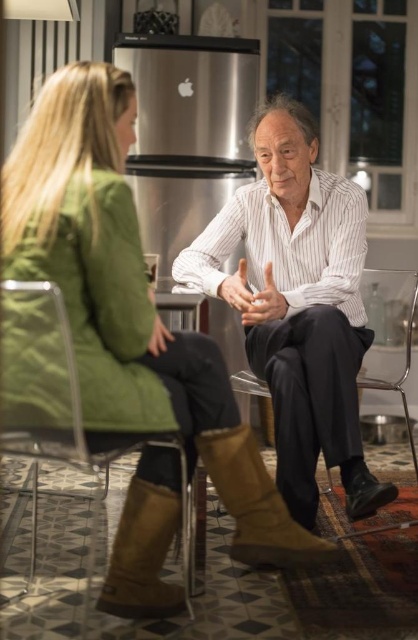
Question: Which of these objects is positioned farthest from the white striped shirt at center?

Choices:
 (A) green suede boots at lower center
 (B) transparent plastic chair at center

Answer: (A)

Question: Which of these objects is positioned closest to the white striped shirt at center?

Choices:
 (A) matte brown hand at center
 (B) clear plastic chair at lower left

Answer: (A)

Question: Is clear plastic chair at lower left above matte white hand at center?

Choices:
 (A) no
 (B) yes

Answer: (A)

Question: Can you confirm if green suede boots at lower center is bigger than transparent plastic chair at center?

Choices:
 (A) yes
 (B) no

Answer: (A)

Question: Which point is farther to the camera?

Choices:
 (A) (300, 104)
 (B) (384, 269)

Answer: (B)

Question: Does green suede boots at lower center appear over matte brown hand at center?

Choices:
 (A) yes
 (B) no

Answer: (B)